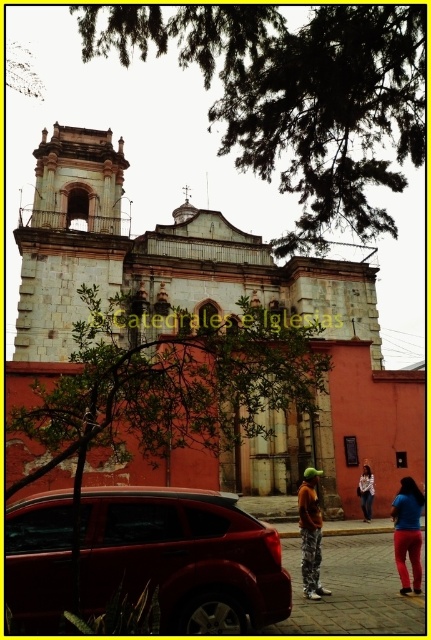
Question: Which point is farther from the camera taking this photo?

Choices:
 (A) (306, 484)
 (B) (362, 492)

Answer: (B)

Question: Is smooth stone church at center closer to the viewer compared to shiny red suv at lower left?

Choices:
 (A) yes
 (B) no

Answer: (B)

Question: Which is farther from the smooth stone church at center?

Choices:
 (A) green leafy tree at upper center
 (B) orange fabric pants at center
 (C) blue fabric pants at lower right

Answer: (C)

Question: Can you confirm if green leafy tree at upper center is bigger than blue fabric pants at lower right?

Choices:
 (A) yes
 (B) no

Answer: (A)

Question: Is shiny red suv at lower left smaller than white cotton shirt at center?

Choices:
 (A) no
 (B) yes

Answer: (A)

Question: Among these points, which one is farthest from the camera?

Choices:
 (A) (262, 17)
 (B) (358, 490)
 (C) (80, 260)
 (D) (303, 500)

Answer: (C)